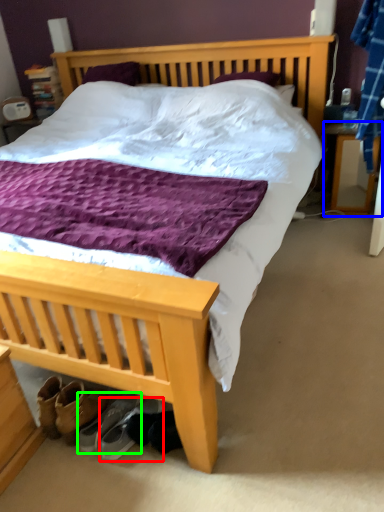
Question: Which object is the closest to the footwear (highlighted by a red box)? Choose among these: nightstand (highlighted by a blue box) or footwear (highlighted by a green box).

Choices:
 (A) nightstand
 (B) footwear

Answer: (B)